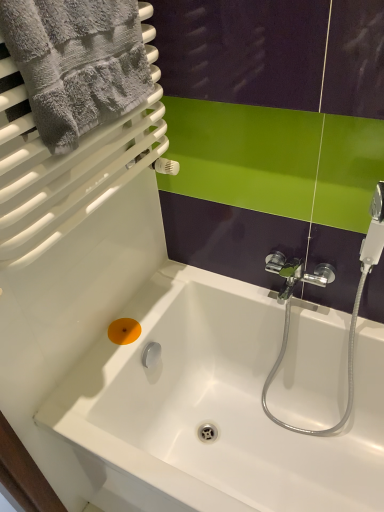
Where is `vacant space behind orange matte soap at lower left`? This screenshot has height=512, width=384. vacant space behind orange matte soap at lower left is located at coordinates (156, 296).